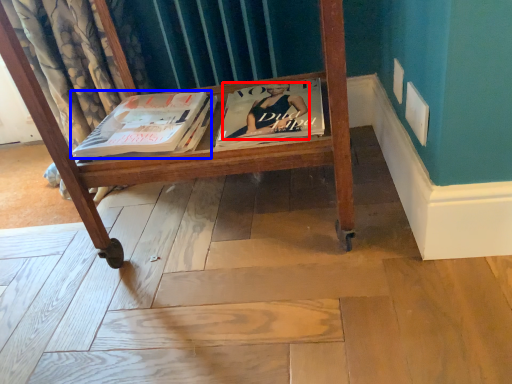
Question: Which point is closer to the camera, person (highlighted by a red box) or book (highlighted by a blue box)?

Choices:
 (A) person
 (B) book

Answer: (A)